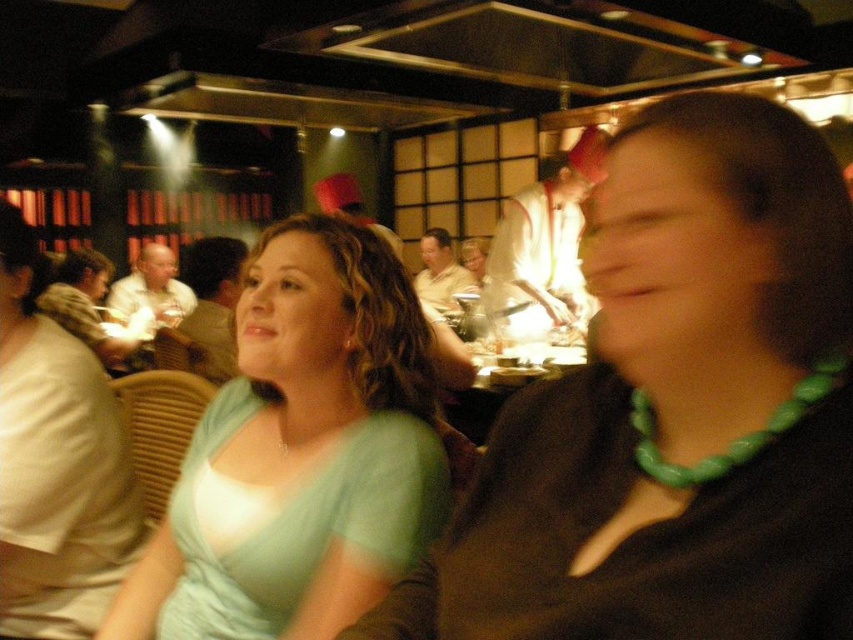
You are a guest at this restaurant and want to compliment the chef on their attire. You see the green beaded necklace at right and the matte black chef hat at center. Which item should you mention to the chef if you want to talk about the accessory they are wearing?

The matte black chef hat at center is the accessory the chef is wearing. The green beaded necklace at right is located below it, but since the chef typically wears a hat, the matte black chef hat at center is the appropriate item to mention.

You are a photographer trying to capture a candid shot of the light green fabric dress at upper left and the white glossy chef at center. Since you want both subjects in the frame, which one should you position closer to the left side of your camera viewfinder?

The light green fabric dress at upper left is positioned on the left side of white glossy chef at center, so to include both in the frame, you should position the light green fabric dress at upper left closer to the left side of your camera viewfinder.

From the picture: What is the 2D coordinate of the light green fabric dress at upper left in the image?

The 2D coordinate of the light green fabric dress at upper left is at point (56, 465).